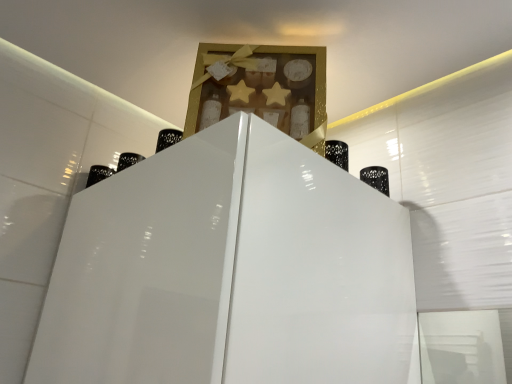
Question: Considering the relative sizes of black matte bottle at right and gold textured box at upper center in the image provided, is black matte bottle at right wider than gold textured box at upper center?

Choices:
 (A) yes
 (B) no

Answer: (B)

Question: From the image's perspective, is black matte bottle at right below gold textured box at upper center?

Choices:
 (A) yes
 (B) no

Answer: (A)

Question: Considering the relative sizes of black matte bottle at right and gold textured box at upper center in the image provided, is black matte bottle at right bigger than gold textured box at upper center?

Choices:
 (A) no
 (B) yes

Answer: (A)

Question: From a real-world perspective, is black matte bottle at right on top of gold textured box at upper center?

Choices:
 (A) no
 (B) yes

Answer: (A)

Question: From a real-world perspective, is black matte bottle at right under gold textured box at upper center?

Choices:
 (A) no
 (B) yes

Answer: (B)

Question: Is black matte bottle at right at the right side of gold textured box at upper center?

Choices:
 (A) yes
 (B) no

Answer: (A)

Question: Would you consider gold textured box at upper center to be distant from black matte bottle at right?

Choices:
 (A) no
 (B) yes

Answer: (A)

Question: Does gold textured box at upper center have a smaller size compared to black matte bottle at right?

Choices:
 (A) no
 (B) yes

Answer: (A)

Question: From the image's perspective, is gold textured box at upper center on black matte bottle at right?

Choices:
 (A) yes
 (B) no

Answer: (A)

Question: From the image's perspective, is gold textured box at upper center below black matte bottle at right?

Choices:
 (A) yes
 (B) no

Answer: (B)

Question: Can we say gold textured box at upper center lies outside black matte bottle at right?

Choices:
 (A) yes
 (B) no

Answer: (A)

Question: Considering the relative sizes of gold textured box at upper center and black matte bottle at right in the image provided, is gold textured box at upper center taller than black matte bottle at right?

Choices:
 (A) no
 (B) yes

Answer: (B)

Question: From a real-world perspective, is black matte bottle at right above or below gold textured box at upper center?

Choices:
 (A) below
 (B) above

Answer: (A)